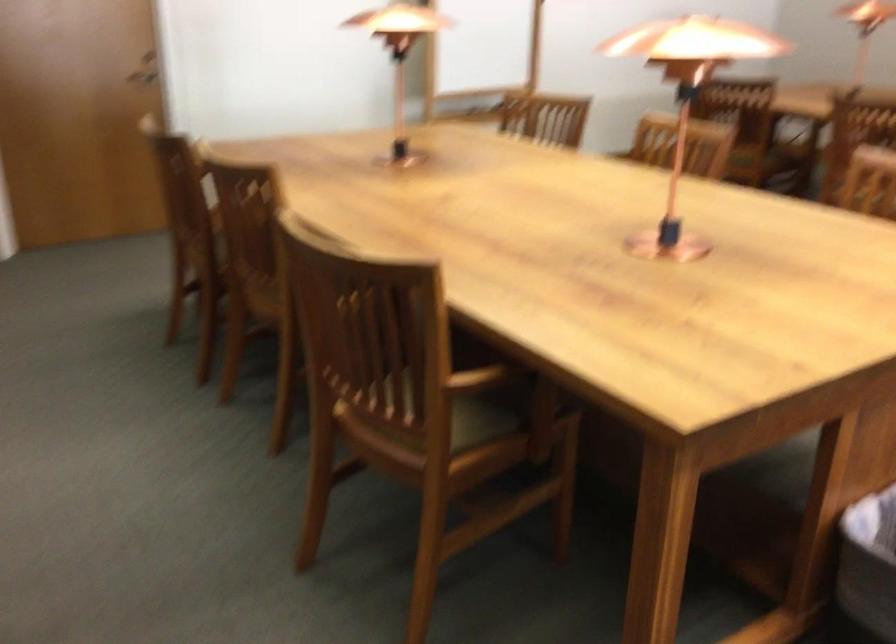
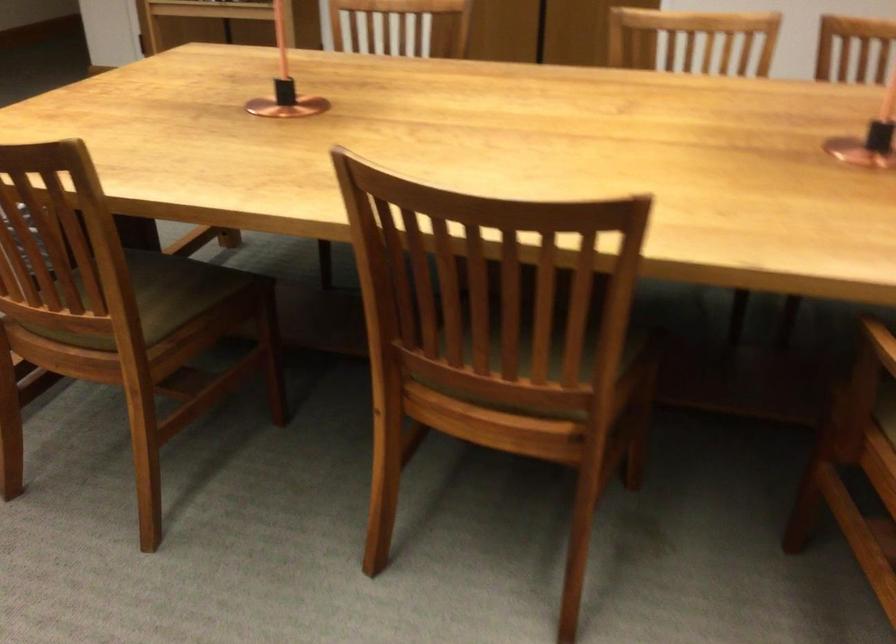
Where in the second image is the point corresponding to (674,223) from the first image?

(285, 84)